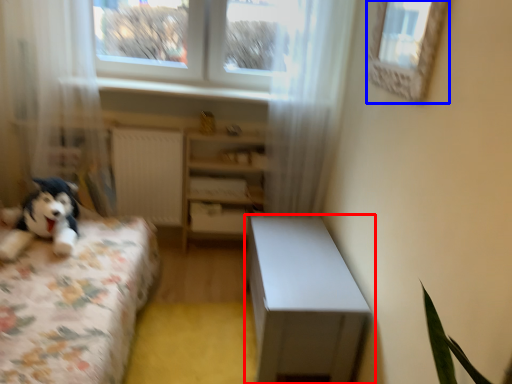
Question: Which of the following is the farthest to the observer, table (highlighted by a red box) or window (highlighted by a blue box)?

Choices:
 (A) table
 (B) window

Answer: (A)